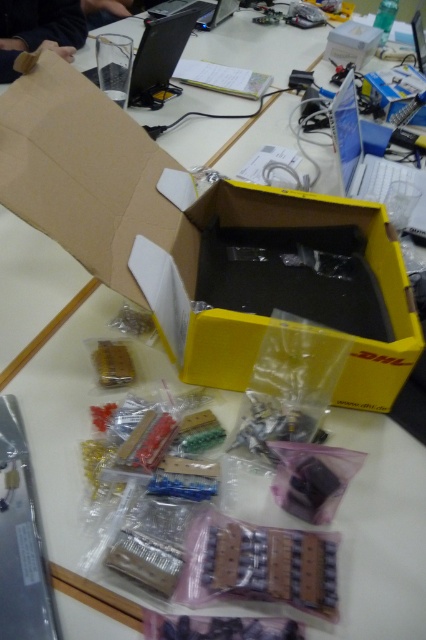
You are a technician working on the DHL shipping box. You need to identify which of the two points, point (x=423, y=179) or point (x=342, y=52), is closer to your current position. Which point should you move towards?

Point (x=423, y=179) is closer to the camera than point (x=342, y=52), so you should move towards point (x=423, y=179).

You are an electronics technician working on a project. You need to place a new component between the silver metallic laptop at upper right and the black plastic laptop at upper center. Based on their positions, where should you position the component?

The silver metallic laptop at upper right is to the right of the black plastic laptop at upper center, so you should place the new component between them in the space between the two laptops.